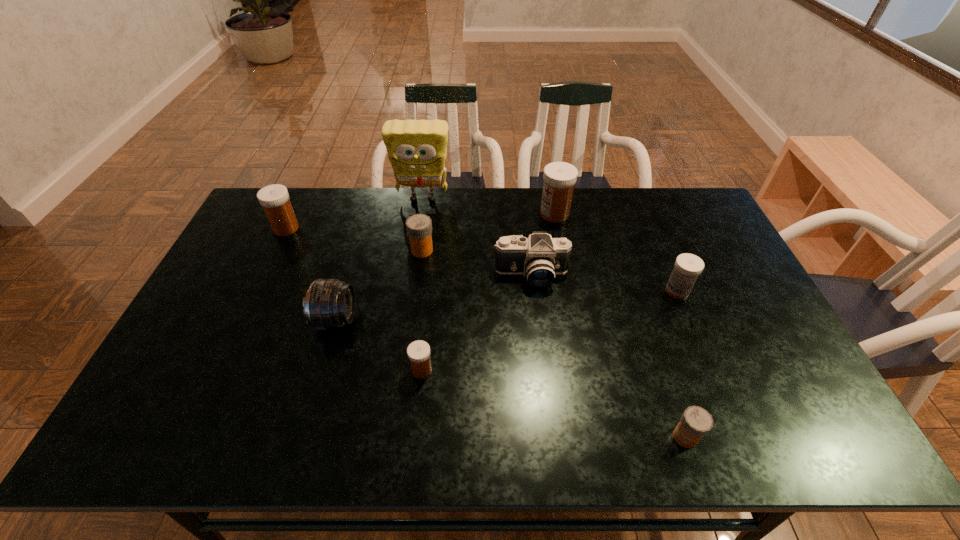
Locate an element on the screen. The height and width of the screenshot is (540, 960). vacant area in the image that satisfies the following two spatial constraints: 1. on the back side of the third white medicine from left to right; 2. on the right side of the fifth farthest medicine is located at coordinates (439, 214).

At what (x,y) coordinates should I click in order to perform the action: click on vacant area in the image that satisfies the following two spatial constraints: 1. on the front side of the fourth farthest medicine; 2. on the label side of the nearer orange medicine. Please return your answer as a coordinate pair (x, y). Looking at the image, I should click on (738, 437).